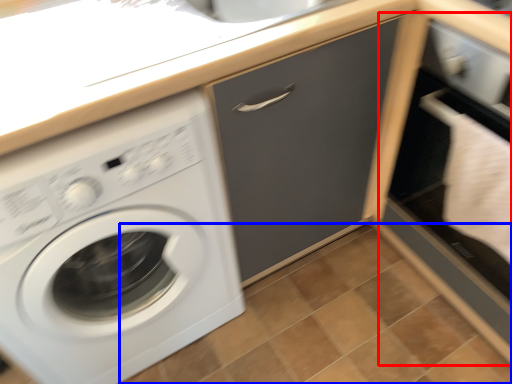
Question: Which object is further to the camera taking this photo, file cabinet (highlighted by a red box) or tile (highlighted by a blue box)?

Choices:
 (A) file cabinet
 (B) tile

Answer: (B)